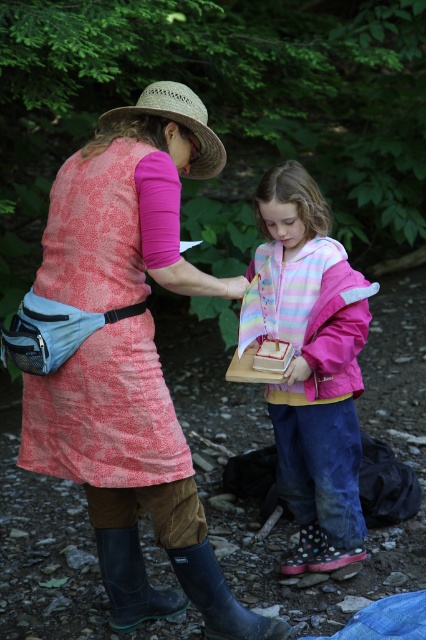
Between point (66, 374) and point (230, 632), which one is positioned behind?

The point (230, 632) is behind.

Is matte pink dress at center below rubber boots at lower center?

Incorrect, matte pink dress at center is not positioned below rubber boots at lower center.

Does point (131, 522) lie in front of point (261, 627)?

No, (131, 522) is further to viewer.

At what (x,y) coordinates should I click in order to perform the action: click on matte pink dress at center. Please return your answer as a coordinate pair (x, y). Image resolution: width=426 pixels, height=640 pixels. Looking at the image, I should click on (131, 356).

Who is positioned more to the right, patterned fabric dress at left or rubber boots at lower left?

rubber boots at lower left

Between point (155, 352) and point (149, 604), which one is positioned in front?

Point (155, 352) is in front.

Image resolution: width=426 pixels, height=640 pixels. What do you see at coordinates (104, 413) in the screenshot?
I see `patterned fabric dress at left` at bounding box center [104, 413].

You are a GUI agent. You are given a task and a screenshot of the screen. Output one action in this format:
    pyautogui.click(x=<x>, y=<y>)
    Task: Click on the patterned fabric dress at left
    Image resolution: width=426 pixels, height=640 pixels.
    Given the screenshot: What is the action you would take?
    pyautogui.click(x=104, y=413)

Can you confirm if pink fabric jacket at center is positioned to the left of strawmaterial/texturehat at upper left?

In fact, pink fabric jacket at center is to the right of strawmaterial/texturehat at upper left.

Is point (284, 195) positioned before point (155, 99)?

No, it is behind (155, 99).

Identify the location of pink fabric jacket at center. Image resolution: width=426 pixels, height=640 pixels. (310, 364).